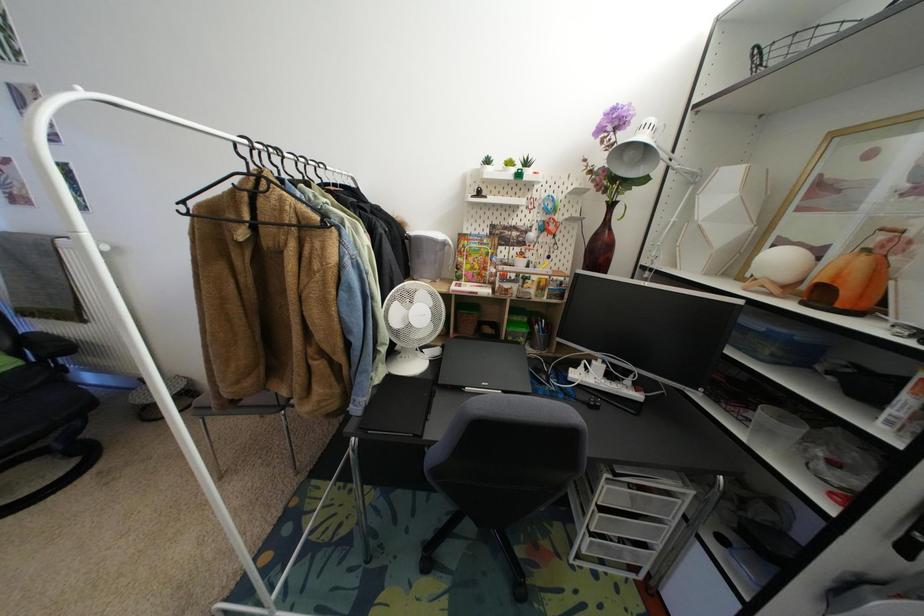
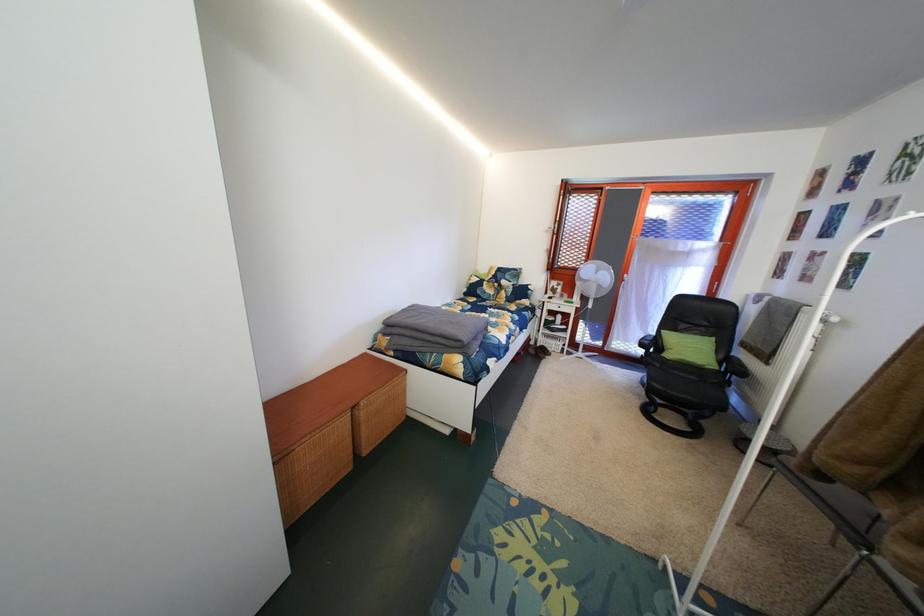
First-person continuous shooting, in which direction is the camera rotating?

The rotation direction of the camera is left-down.